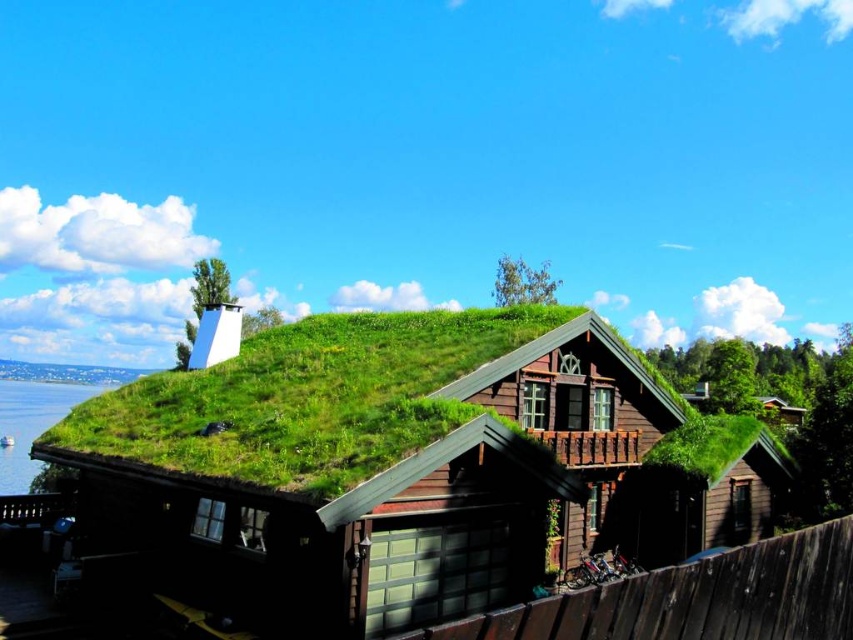
Does brown wooden cabin at center have a lesser height compared to blue water at lower left?

Indeed, brown wooden cabin at center has a lesser height compared to blue water at lower left.

Can you confirm if brown wooden cabin at center is positioned above blue water at lower left?

Yes.

Measure the distance between point (x=590, y=470) and camera.

A distance of 20.57 meters exists between point (x=590, y=470) and camera.

Locate an element on the screen. The width and height of the screenshot is (853, 640). brown wooden cabin at center is located at coordinates (577, 412).